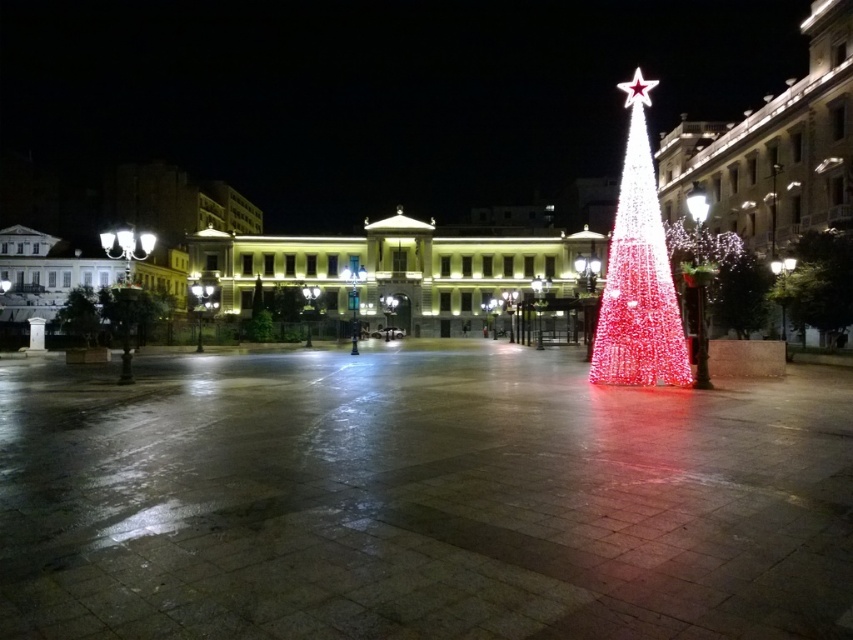
Which is more to the right, illuminated plastic christmas tree at right or green leafy tree at left?

Positioned to the right is illuminated plastic christmas tree at right.

Can you confirm if illuminated plastic christmas tree at right is taller than green leafy tree at left?

Indeed, illuminated plastic christmas tree at right has a greater height compared to green leafy tree at left.

Who is more forward, (x=810, y=280) or (x=83, y=340)?

Positioned in front is point (x=810, y=280).

Find the location of `illuminated plastic christmas tree at right`. illuminated plastic christmas tree at right is located at coordinates (817, 282).

Between illuminated white lights at center and green leafy tree at left, which one is positioned lower?

green leafy tree at left

Between illuminated white lights at center and green leafy tree at left, which one appears on the left side from the viewer's perspective?

green leafy tree at left

Consider the image. Who is more forward, (x=639, y=234) or (x=68, y=298)?

Point (x=639, y=234) is more forward.

This screenshot has height=640, width=853. I want to click on illuminated white lights at center, so click(x=637, y=273).

Which is more to the right, illuminated white lights at center or illuminated plastic christmas tree at right?

illuminated plastic christmas tree at right

Can you confirm if illuminated white lights at center is thinner than illuminated plastic christmas tree at right?

No, illuminated white lights at center is not thinner than illuminated plastic christmas tree at right.

Measure the distance between illuminated white lights at center and camera.

illuminated white lights at center and camera are 73.91 meters apart from each other.

At what (x,y) coordinates should I click in order to perform the action: click on illuminated white lights at center. Please return your answer as a coordinate pair (x, y). Image resolution: width=853 pixels, height=640 pixels. Looking at the image, I should click on (637, 273).